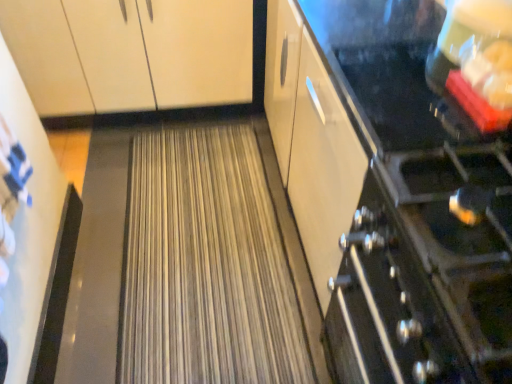
What do you see at coordinates (410, 208) in the screenshot?
I see `satin black stove at right` at bounding box center [410, 208].

You are a GUI agent. You are given a task and a screenshot of the screen. Output one action in this format:
    pyautogui.click(x=<x>, y=<y>)
    Task: Click on the satin black stove at right
    The width and height of the screenshot is (512, 384).
    Given the screenshot: What is the action you would take?
    pyautogui.click(x=410, y=208)

Locate an element on the screen. matte white cabinet at upper left is located at coordinates (45, 56).

What do you see at coordinates (45, 56) in the screenshot? The height and width of the screenshot is (384, 512). I see `matte white cabinet at upper left` at bounding box center [45, 56].

Where is `satin black stove at right`? The width and height of the screenshot is (512, 384). satin black stove at right is located at coordinates click(410, 208).

Is matte white cabinet at upper left to the left of satin black stove at right from the viewer's perspective?

Correct, you'll find matte white cabinet at upper left to the left of satin black stove at right.

Is matte white cabinet at upper left positioned before satin black stove at right?

No, it is behind satin black stove at right.

Considering the positions of point (79, 110) and point (431, 318), is point (79, 110) closer or farther from the camera than point (431, 318)?

Clearly, point (79, 110) is more distant from the camera than point (431, 318).

From the image's perspective, which object appears higher, matte white cabinet at upper left or satin black stove at right?

matte white cabinet at upper left appears higher in the image.

From a real-world perspective, who is located lower, matte white cabinet at upper left or satin black stove at right?

matte white cabinet at upper left.

In terms of width, does matte white cabinet at upper left look wider or thinner when compared to satin black stove at right?

Clearly, matte white cabinet at upper left has more width compared to satin black stove at right.

Who is shorter, matte white cabinet at upper left or satin black stove at right?

With less height is matte white cabinet at upper left.

Which of these two, matte white cabinet at upper left or satin black stove at right, is bigger?

satin black stove at right.

Is satin black stove at right inside matte white cabinet at upper left?

No, satin black stove at right is not inside matte white cabinet at upper left.

Are matte white cabinet at upper left and satin black stove at right making contact?

No, matte white cabinet at upper left is not next to satin black stove at right.

Could you tell me if matte white cabinet at upper left is facing satin black stove at right?

No, matte white cabinet at upper left is not oriented towards satin black stove at right.

Looking at this image, can you tell me how much matte white cabinet at upper left and satin black stove at right differ in facing direction?

There is a 0.739-degree angle between the facing directions of matte white cabinet at upper left and satin black stove at right.

The height and width of the screenshot is (384, 512). Find the location of `appliance in front of the matte white cabinet at upper left`. appliance in front of the matte white cabinet at upper left is located at coordinates pyautogui.click(x=410, y=208).

Is satin black stove at right to the left or to the right of matte white cabinet at upper left in the image?

satin black stove at right is positioned on matte white cabinet at upper left's right side.

Between satin black stove at right and matte white cabinet at upper left, which one is positioned behind?

matte white cabinet at upper left.

Is point (370, 325) less distant than point (40, 70)?

Yes, point (370, 325) is closer to viewer.

From the image's perspective, does satin black stove at right appear lower than matte white cabinet at upper left?

Yes, from the image's perspective, satin black stove at right is beneath matte white cabinet at upper left.

From a real-world perspective, is satin black stove at right positioned under matte white cabinet at upper left based on gravity?

No.

Considering the sizes of satin black stove at right and matte white cabinet at upper left in the image, is satin black stove at right wider or thinner than matte white cabinet at upper left?

satin black stove at right is thinner than matte white cabinet at upper left.

Is satin black stove at right shorter than matte white cabinet at upper left?

Incorrect, the height of satin black stove at right does not fall short of that of matte white cabinet at upper left.

In terms of size, does satin black stove at right appear bigger or smaller than matte white cabinet at upper left?

satin black stove at right is bigger than matte white cabinet at upper left.

Is satin black stove at right outside of matte white cabinet at upper left?

Yes, satin black stove at right is not within matte white cabinet at upper left.

Is satin black stove at right far from matte white cabinet at upper left?

That's right, there is a large distance between satin black stove at right and matte white cabinet at upper left.

Does satin black stove at right turn towards matte white cabinet at upper left?

No, satin black stove at right is not facing towards matte white cabinet at upper left.

How different are the orientations of satin black stove at right and matte white cabinet at upper left in degrees?

satin black stove at right and matte white cabinet at upper left are facing 0.739 degrees away from each other.

Where is `appliance on the right of the matte white cabinet at upper left`? The height and width of the screenshot is (384, 512). appliance on the right of the matte white cabinet at upper left is located at coordinates (410, 208).

The height and width of the screenshot is (384, 512). In the image, there is a matte white cabinet at upper left. In order to click on appliance below it (from the image's perspective) in this screenshot , I will do `click(410, 208)`.

In order to click on appliance positioned vertically above the matte white cabinet at upper left (from a real-world perspective) in this screenshot , I will do `click(410, 208)`.